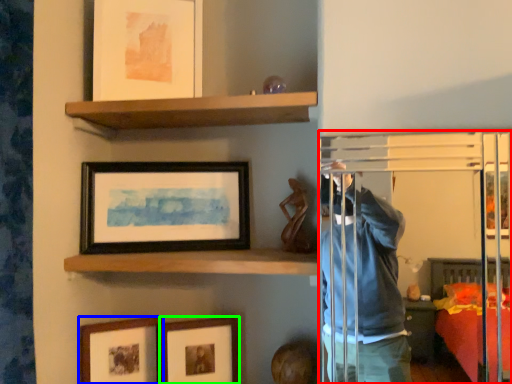
Question: Which is nearer to the glass door (highlighted by a red box)? picture frame (highlighted by a blue box) or picture frame (highlighted by a green box).

Choices:
 (A) picture frame
 (B) picture frame

Answer: (B)